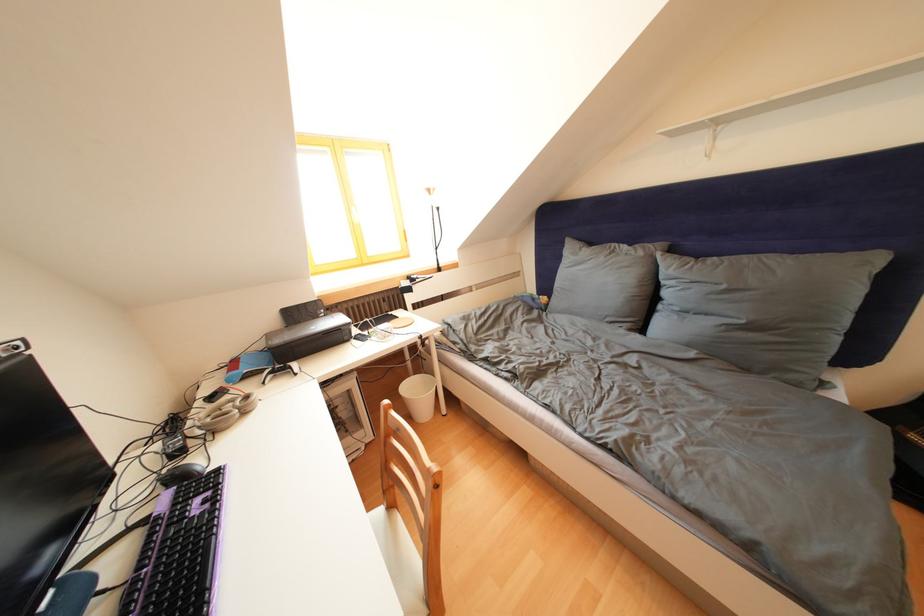
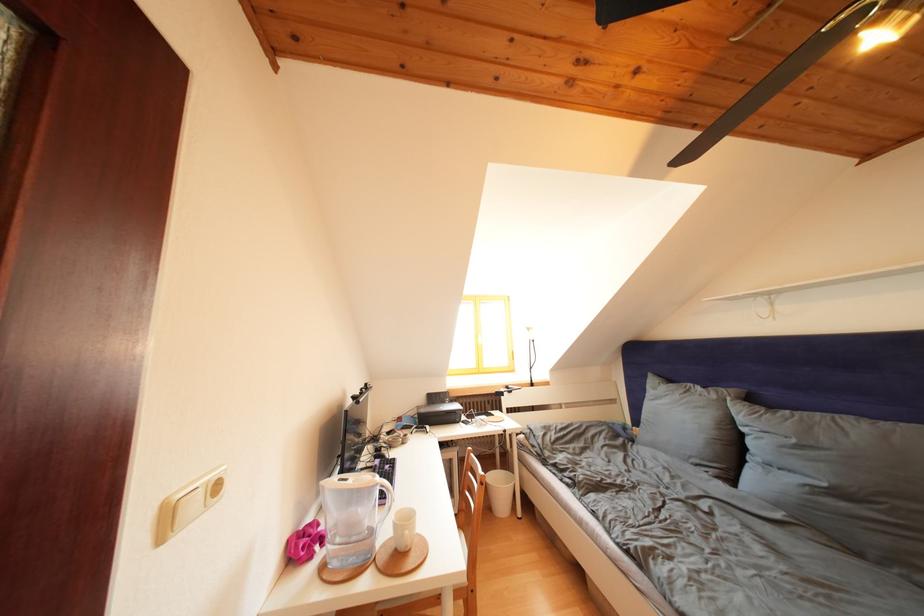
Find the pixel in the second image that matches (733,292) in the first image.

(801, 446)